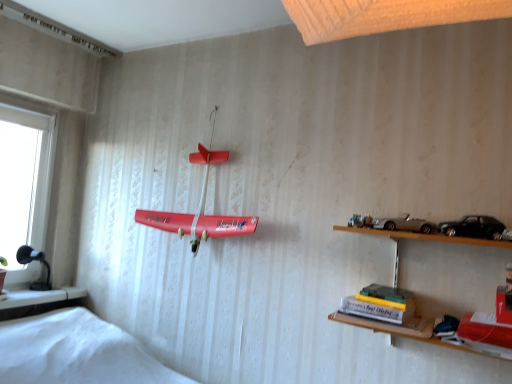
Question: From the image's perspective, is matte red airplane at center beneath silver metallic toy car at upper right, the 2th toy car from the front?

Choices:
 (A) no
 (B) yes

Answer: (A)

Question: Does matte red airplane at center have a lesser height compared to silver metallic toy car at upper right, placed as the 1th toy car when sorted from back to front?

Choices:
 (A) yes
 (B) no

Answer: (B)

Question: Is matte red airplane at center far from silver metallic toy car at upper right, arranged as the second toy car when viewed from the right?

Choices:
 (A) no
 (B) yes

Answer: (A)

Question: Is silver metallic toy car at upper right, the 2th toy car from the front, completely or partially inside matte red airplane at center?

Choices:
 (A) no
 (B) yes

Answer: (A)

Question: Is matte red airplane at center taller than silver metallic toy car at upper right, placed as the 1th toy car when sorted from back to front?

Choices:
 (A) no
 (B) yes

Answer: (B)

Question: Could you tell me if matte red airplane at center is facing silver metallic toy car at upper right, the 2th toy car from the front?

Choices:
 (A) yes
 (B) no

Answer: (B)

Question: Can you confirm if matte red airplane at center is positioned to the left of hardcover book at lower right?

Choices:
 (A) no
 (B) yes

Answer: (B)

Question: Is matte red airplane at center outside of hardcover book at lower right?

Choices:
 (A) no
 (B) yes

Answer: (B)

Question: Considering the relative sizes of matte red airplane at center and hardcover book at lower right in the image provided, is matte red airplane at center bigger than hardcover book at lower right?

Choices:
 (A) yes
 (B) no

Answer: (A)

Question: From a real-world perspective, is matte red airplane at center located higher than hardcover book at lower right?

Choices:
 (A) yes
 (B) no

Answer: (A)

Question: Is the depth of matte red airplane at center greater than that of hardcover book at lower right?

Choices:
 (A) yes
 (B) no

Answer: (A)

Question: Considering the relative sizes of matte red airplane at center and hardcover book at lower right in the image provided, is matte red airplane at center smaller than hardcover book at lower right?

Choices:
 (A) no
 (B) yes

Answer: (A)

Question: Considering the relative sizes of hardcover book at lower right and silver metallic toy car at upper right, the 2th toy car from the front, in the image provided, is hardcover book at lower right shorter than silver metallic toy car at upper right, the 2th toy car from the front,?

Choices:
 (A) yes
 (B) no

Answer: (B)